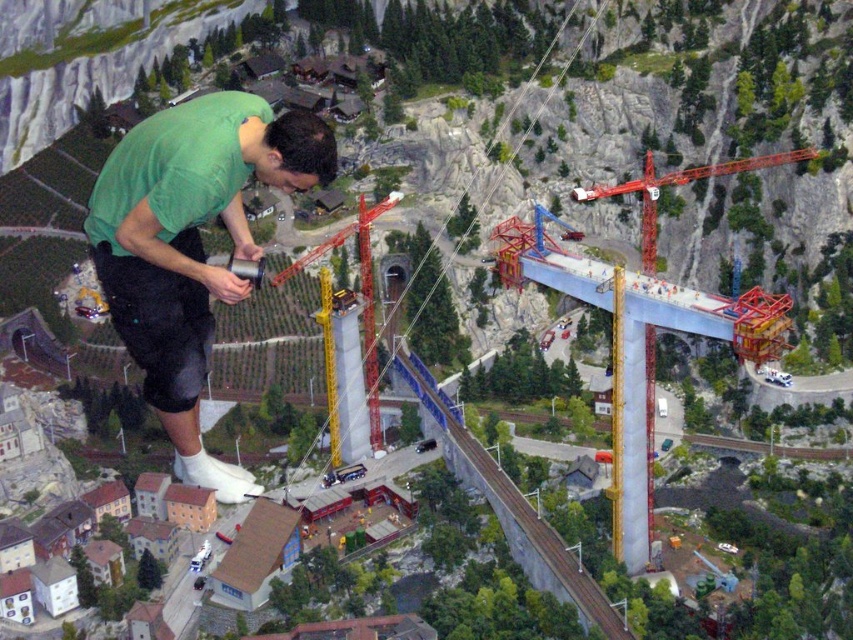
Question: Which point is closer to the camera taking this photo?

Choices:
 (A) (621, 492)
 (B) (126, 141)
 (C) (325, 294)

Answer: (B)

Question: Can you confirm if green matte shirt at upper left is bigger than yellow metallic crane at center?

Choices:
 (A) no
 (B) yes

Answer: (B)

Question: Is orange metallic crane at upper right bigger than yellow metallic crane at center?

Choices:
 (A) no
 (B) yes

Answer: (B)

Question: In this image, where is green matte shirt at upper left located relative to orange metallic crane at upper right?

Choices:
 (A) left
 (B) right

Answer: (A)

Question: Which point is farther from the camera taking this photo?

Choices:
 (A) (363, 332)
 (B) (651, 349)
 (C) (126, 161)

Answer: (A)

Question: Which point appears farthest from the camera in this image?

Choices:
 (A) (641, 180)
 (B) (276, 118)

Answer: (A)